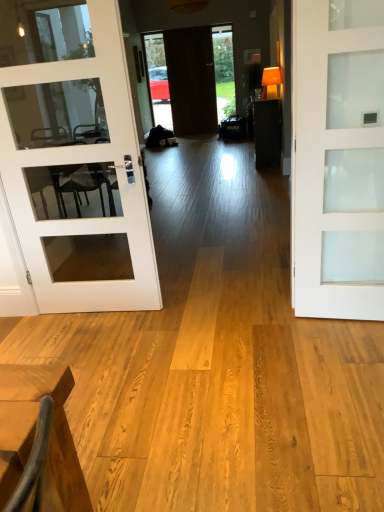
Question: Could you tell me if dark wood table at center is turned towards white glass door at left, the 1th door in the left-to-right sequence?

Choices:
 (A) no
 (B) yes

Answer: (A)

Question: Considering the relative sizes of dark wood table at center and white glass door at left, marked as the 3th door in a right-to-left arrangement, in the image provided, is dark wood table at center shorter than white glass door at left, marked as the 3th door in a right-to-left arrangement,?

Choices:
 (A) yes
 (B) no

Answer: (A)

Question: Does dark wood table at center have a greater height compared to white glass door at left, the 1th door in the left-to-right sequence?

Choices:
 (A) no
 (B) yes

Answer: (A)

Question: From a real-world perspective, is dark wood table at center on white glass door at left, acting as the 2th door starting from the back?

Choices:
 (A) yes
 (B) no

Answer: (B)

Question: From the image's perspective, is dark wood table at center beneath white glass door at left, the 2th door positioned from the top?

Choices:
 (A) yes
 (B) no

Answer: (B)

Question: Is dark wood door at center, arranged as the third door when viewed from the front, in front of or behind white glass door at left, which ranks as the second door in bottom-to-top order, in the image?

Choices:
 (A) behind
 (B) front

Answer: (A)

Question: From a real-world perspective, is dark wood door at center, marked as the 1th door in a top-to-bottom arrangement, positioned above or below white glass door at left, the 2th door positioned from the top?

Choices:
 (A) below
 (B) above

Answer: (B)

Question: From the image's perspective, relative to white glass door at left, marked as the 3th door in a right-to-left arrangement, is dark wood door at center, marked as the 1th door in a top-to-bottom arrangement, above or below?

Choices:
 (A) above
 (B) below

Answer: (A)

Question: Is point (170, 103) closer or farther from the camera than point (82, 289)?

Choices:
 (A) closer
 (B) farther

Answer: (B)

Question: Would you say white frosted glass door at center, placed as the 1th door when sorted from bottom to top, is inside or outside clear glass door at center?

Choices:
 (A) outside
 (B) inside

Answer: (A)

Question: Visually, is white frosted glass door at center, the third door from the back, positioned to the left or to the right of clear glass door at center?

Choices:
 (A) left
 (B) right

Answer: (B)

Question: In the image, is white frosted glass door at center, the third door positioned from the left, positioned in front of or behind clear glass door at center?

Choices:
 (A) behind
 (B) front

Answer: (B)

Question: Considering the positions of white frosted glass door at center, placed as the third door when sorted from top to bottom, and clear glass door at center in the image, is white frosted glass door at center, placed as the third door when sorted from top to bottom, taller or shorter than clear glass door at center?

Choices:
 (A) short
 (B) tall

Answer: (A)

Question: Visually, is white frosted glass door at center, placed as the 1th door when sorted from bottom to top, positioned to the left or to the right of dark wood table at center?

Choices:
 (A) left
 (B) right

Answer: (A)

Question: From a real-world perspective, relative to dark wood table at center, is white frosted glass door at center, the third door positioned from the left, vertically above or below?

Choices:
 (A) below
 (B) above

Answer: (B)